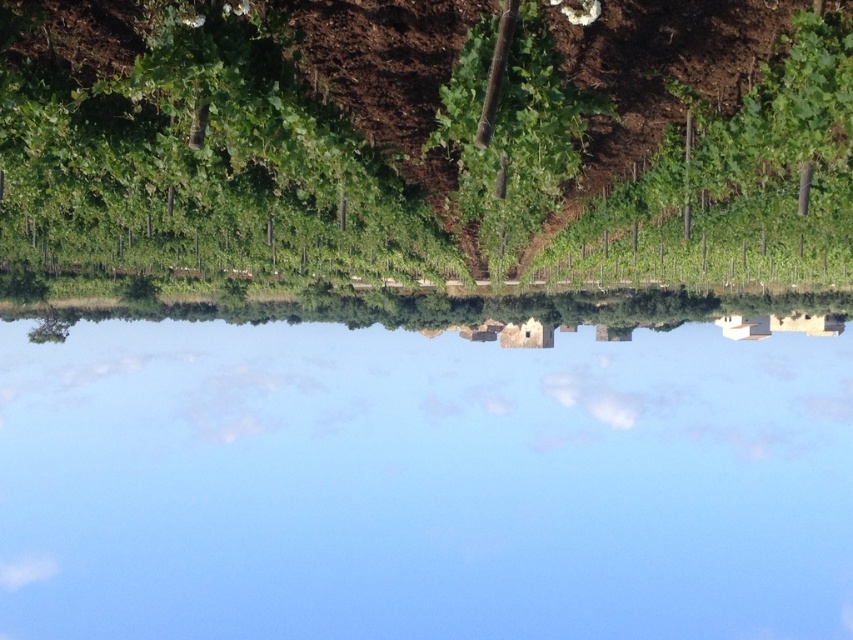
Question: Which point appears farthest from the camera in this image?

Choices:
 (A) (456, 332)
 (B) (447, 88)

Answer: (A)

Question: Can you confirm if blue sky at upper center is wider than green leafy plant at center?

Choices:
 (A) yes
 (B) no

Answer: (A)

Question: Where is blue sky at upper center located in relation to green leafy plant at center in the image?

Choices:
 (A) below
 (B) above

Answer: (A)

Question: Which point is farther to the camera?

Choices:
 (A) (486, 186)
 (B) (213, 636)

Answer: (B)

Question: Which point appears closest to the camera in this image?

Choices:
 (A) (141, 320)
 (B) (567, 122)

Answer: (B)

Question: Observing the image, what is the correct spatial positioning of blue sky at upper center in reference to green leafy plant at center?

Choices:
 (A) above
 (B) below

Answer: (B)